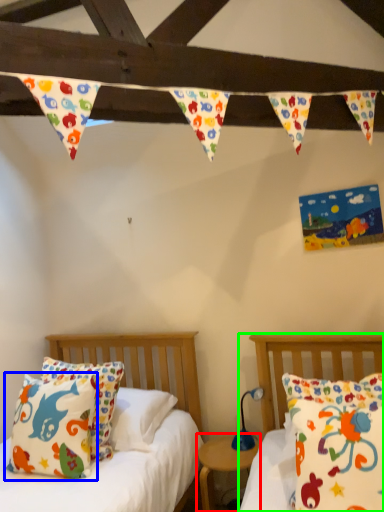
Question: Which object is positioned farthest from nightstand (highlighted by a red box)? Select from pillow (highlighted by a blue box) and bed (highlighted by a green box).

Choices:
 (A) pillow
 (B) bed

Answer: (A)